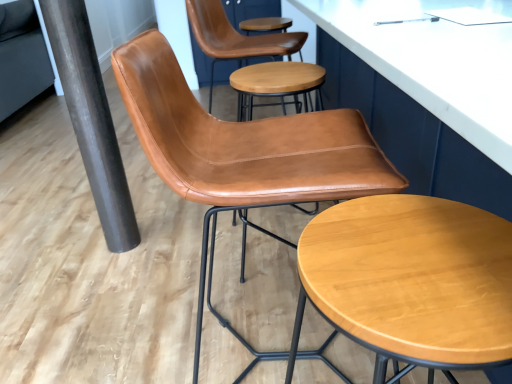
This screenshot has width=512, height=384. Identify the location of free space to the back side of black metallic pole at lower left. (147, 215).